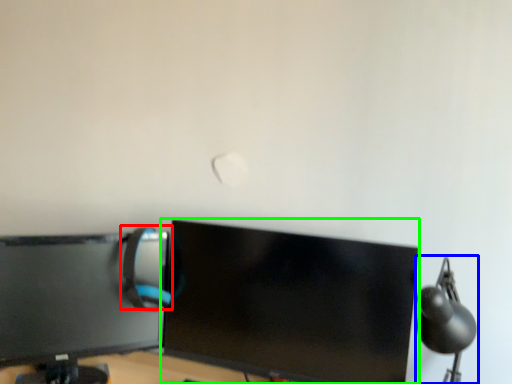
Question: Which object is the closest to the computer chair (highlighted by a red box)? Choose among these: table lamp (highlighted by a blue box) or computer monitor (highlighted by a green box).

Choices:
 (A) table lamp
 (B) computer monitor

Answer: (B)